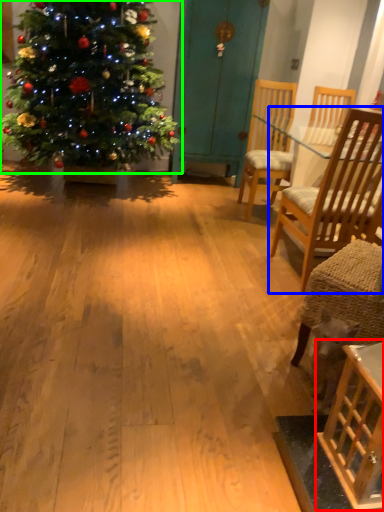
Question: Which object is the farthest from table (highlighted by a red box)? Choose among these: chair (highlighted by a blue box) or christmas tree (highlighted by a green box).

Choices:
 (A) chair
 (B) christmas tree

Answer: (B)